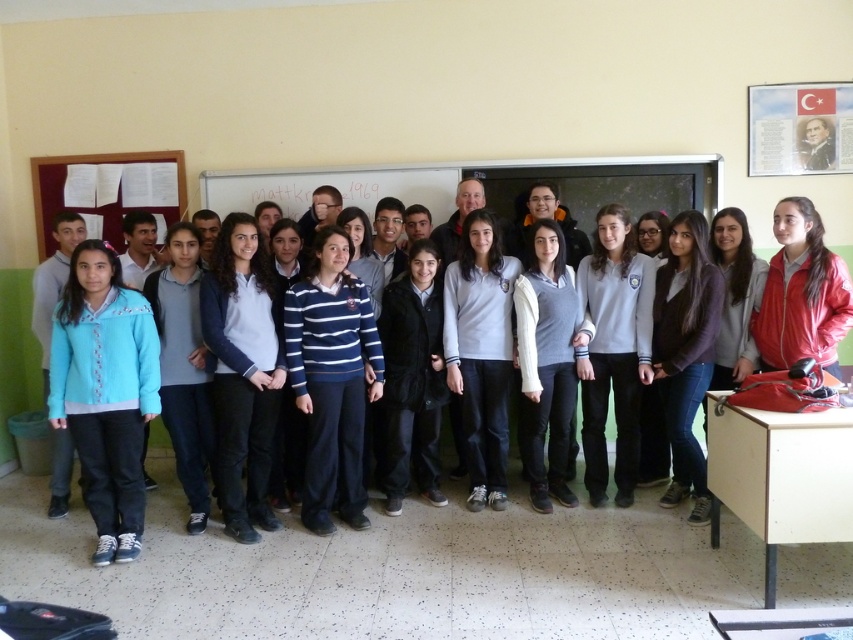
Which is in front, point (151, 332) or point (283, 216)?

Positioned in front is point (151, 332).

Consider the image. Who is positioned more to the right, turquoise fleece jacket at left or white paper at center?

Positioned to the right is white paper at center.

What do you see at coordinates (105, 392) in the screenshot? I see `turquoise fleece jacket at left` at bounding box center [105, 392].

Locate an element on the screen. Image resolution: width=853 pixels, height=640 pixels. turquoise fleece jacket at left is located at coordinates (105, 392).

Does blue striped sweater at center have a larger size compared to white paper at center?

Correct, blue striped sweater at center is larger in size than white paper at center.

Does point (369, 356) come closer to viewer compared to point (326, 172)?

Yes, it is in front of point (326, 172).

At what (x,y) coordinates should I click in order to perform the action: click on blue striped sweater at center. Please return your answer as a coordinate pair (x, y). The width and height of the screenshot is (853, 640). Looking at the image, I should click on (x=331, y=380).

Between gray wool sweater at center and white paper at center, which one has more height?

gray wool sweater at center

Between gray wool sweater at center and white paper at center, which one is positioned lower?

gray wool sweater at center

What do you see at coordinates (546, 364) in the screenshot? Image resolution: width=853 pixels, height=640 pixels. I see `gray wool sweater at center` at bounding box center [546, 364].

The width and height of the screenshot is (853, 640). In order to click on gray wool sweater at center in this screenshot , I will do `click(546, 364)`.